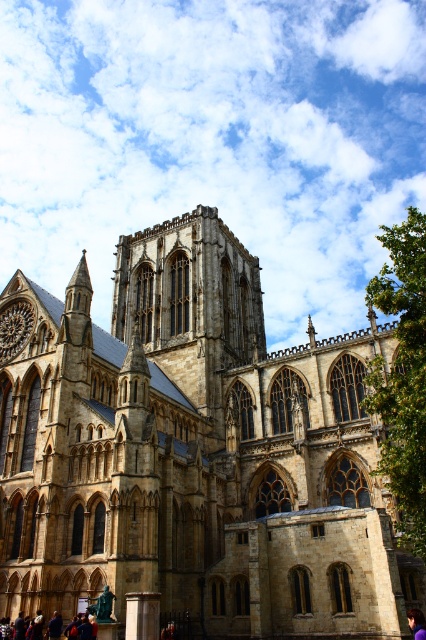
You are standing in front of the cathedral and want to determine which of the two points, point [230,307] or point [414,628], is closer to you. Based on the cathedral structure, which point is nearer?

Point [230,307] is closer to you because it is further to the viewer than point [414,628].

You are standing at the point marked as point (193, 451) in the image. What structure are you facing?

The point (193, 451) corresponds to the brown stone church at center, so you are facing the brown stone church at center.

Consider the image. You are standing in front of the cathedral and notice the brown stone church at center and the purple fabric at lower right. Which object is located higher up in the image?

The brown stone church at center is positioned over the purple fabric at lower right, meaning it is higher up in the image.